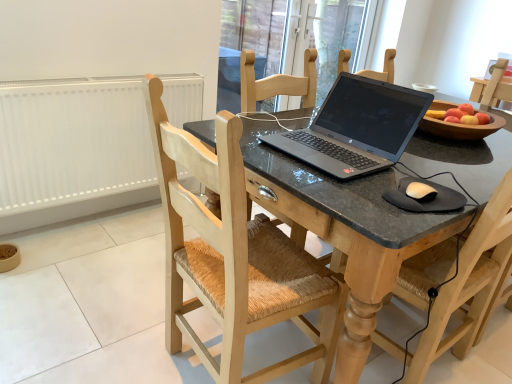
What are the coordinates of `vacant area in front of white matte radiator at left` in the screenshot? It's located at click(91, 273).